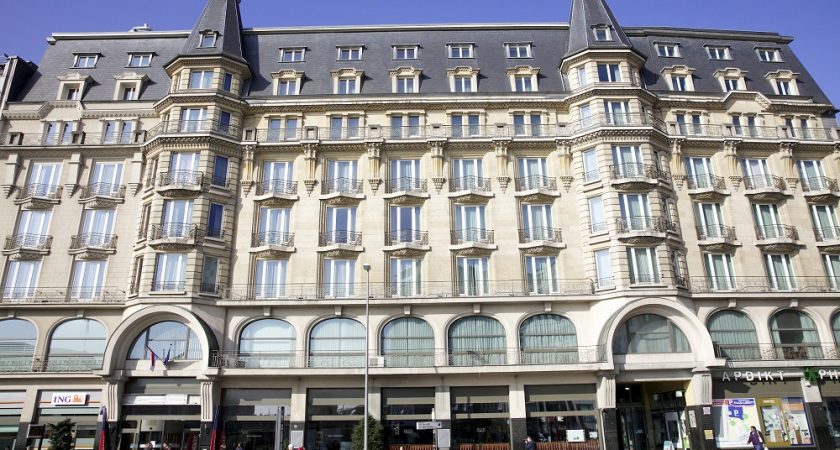
At what (x,y) coordinates should I click in order to perform the action: click on support beams. Please return your answer as a coordinate pair (x, y). This screenshot has height=450, width=840. Looking at the image, I should click on (33, 416), (107, 397), (210, 405), (303, 408), (370, 411), (444, 418), (516, 415), (601, 419), (697, 407), (817, 414).